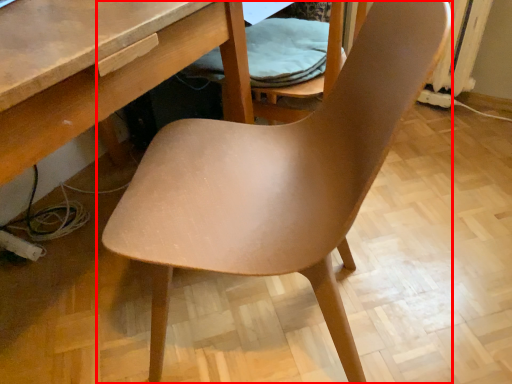
Question: From the image's perspective, what is the correct spatial relationship of chair (annotated by the red box) in relation to folding chair?

Choices:
 (A) above
 (B) below

Answer: (B)